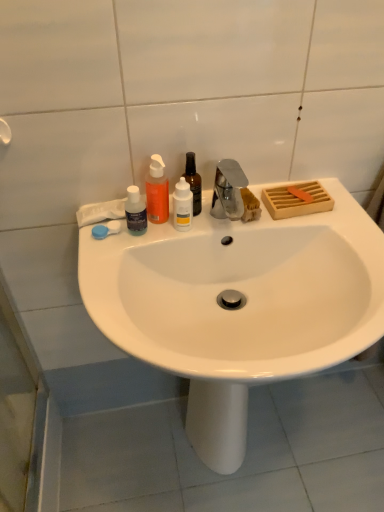
I want to click on free space to the right of blue plastic soap at left, so click(167, 231).